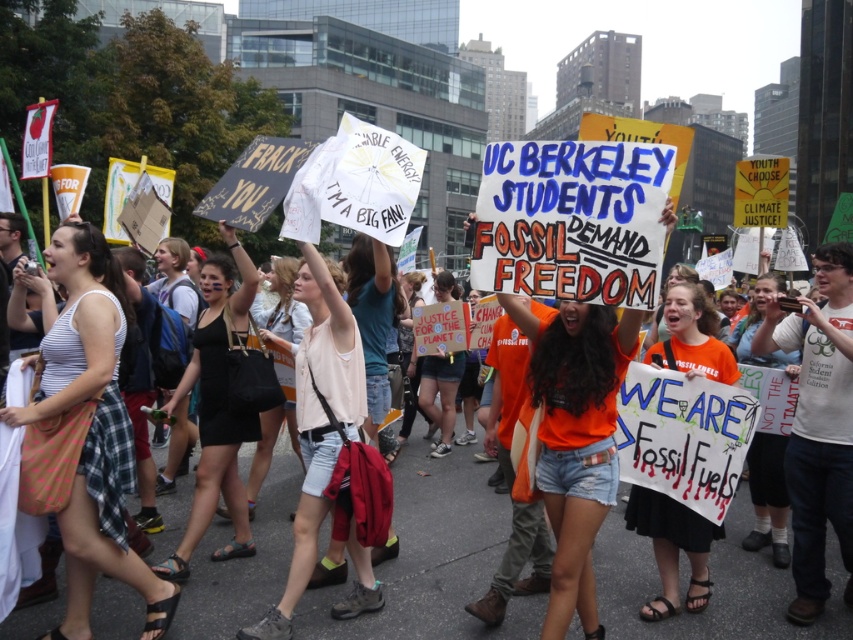
Question: Which point is closer to the camera?

Choices:
 (A) (711, 328)
 (B) (39, 369)
 (C) (401, 426)

Answer: (B)

Question: Which is farther from the orange cotton t-shirt at center?

Choices:
 (A) orange fabric shirt at center
 (B) denim shorts at center

Answer: (A)

Question: Is white cotton shirt at center thinner than denim shorts at center?

Choices:
 (A) yes
 (B) no

Answer: (B)

Question: Which point appears farthest from the camera in this image?

Choices:
 (A) (270, 602)
 (B) (738, 348)
 (C) (431, 422)

Answer: (C)

Question: In this image, where is striped fabric tank top at left located relative to denim shorts at center?

Choices:
 (A) above
 (B) below

Answer: (B)

Question: Is black fabric dress at center bigger than denim shorts at center?

Choices:
 (A) no
 (B) yes

Answer: (B)